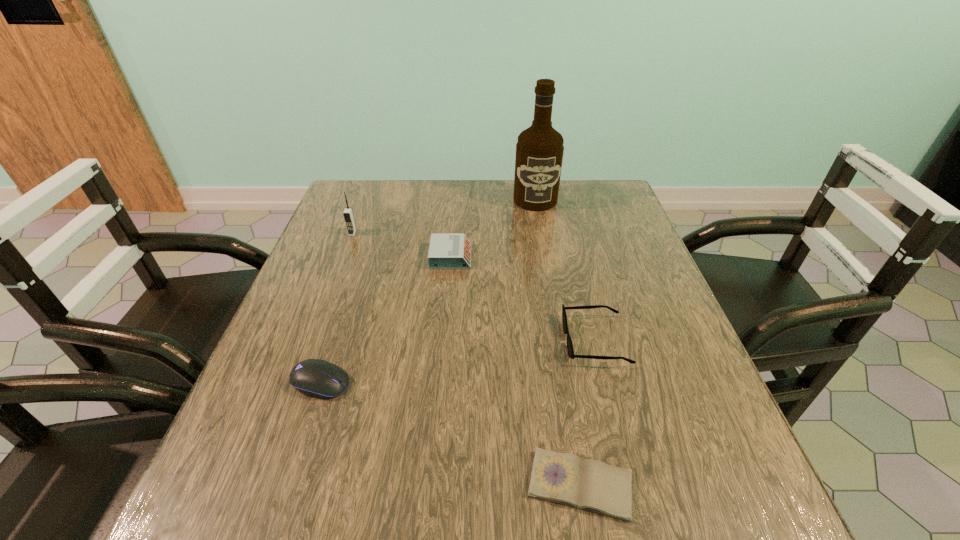
This screenshot has height=540, width=960. Find the location of `the tallest object`. the tallest object is located at coordinates (539, 151).

Locate an element on the screen. the farthest object is located at coordinates (539, 151).

The width and height of the screenshot is (960, 540). Find the location of `cellular telephone`. cellular telephone is located at coordinates (348, 215).

Where is `the second tallest object`? The height and width of the screenshot is (540, 960). the second tallest object is located at coordinates (348, 215).

Where is `the third farthest object`? This screenshot has height=540, width=960. the third farthest object is located at coordinates (446, 250).

In order to click on alarm clock in this screenshot , I will do `click(446, 250)`.

Locate an element on the screen. This screenshot has width=960, height=540. sunglasses is located at coordinates (570, 350).

This screenshot has height=540, width=960. I want to click on computer mouse, so click(318, 378).

Locate an element on the screen. diary is located at coordinates (563, 478).

Identify the location of the nearest object. (563, 478).